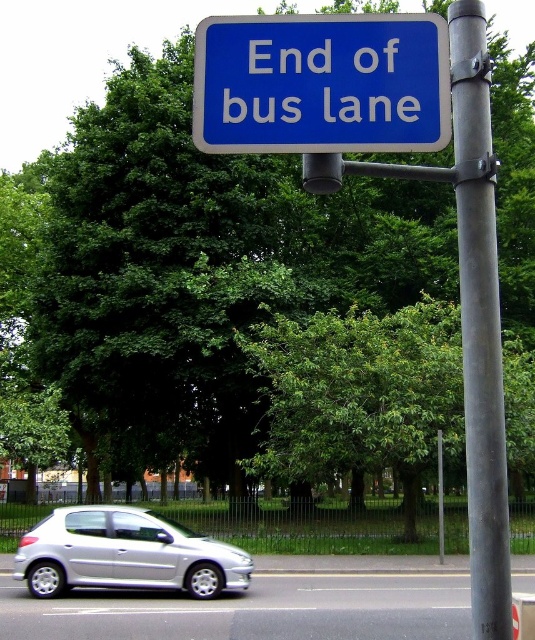
Question: Which point is closer to the camera?

Choices:
 (A) metallic gray pole at center right
 (B) silver metallic car at lower left

Answer: (A)

Question: Among these points, which one is nearest to the camera?

Choices:
 (A) (83, 563)
 (B) (297, 97)

Answer: (B)

Question: Which point is closer to the camera?

Choices:
 (A) (460, 288)
 (B) (146, 579)

Answer: (B)

Question: Is blue plastic sign at upper center positioned in front of metallic gray pole at center right?

Choices:
 (A) no
 (B) yes

Answer: (A)

Question: Is blue plastic sign at upper center to the left of silver metallic car at lower left from the viewer's perspective?

Choices:
 (A) no
 (B) yes

Answer: (A)

Question: Considering the relative positions of metallic gray pole at center right and silver metallic car at lower left in the image provided, where is metallic gray pole at center right located with respect to silver metallic car at lower left?

Choices:
 (A) right
 (B) left

Answer: (A)